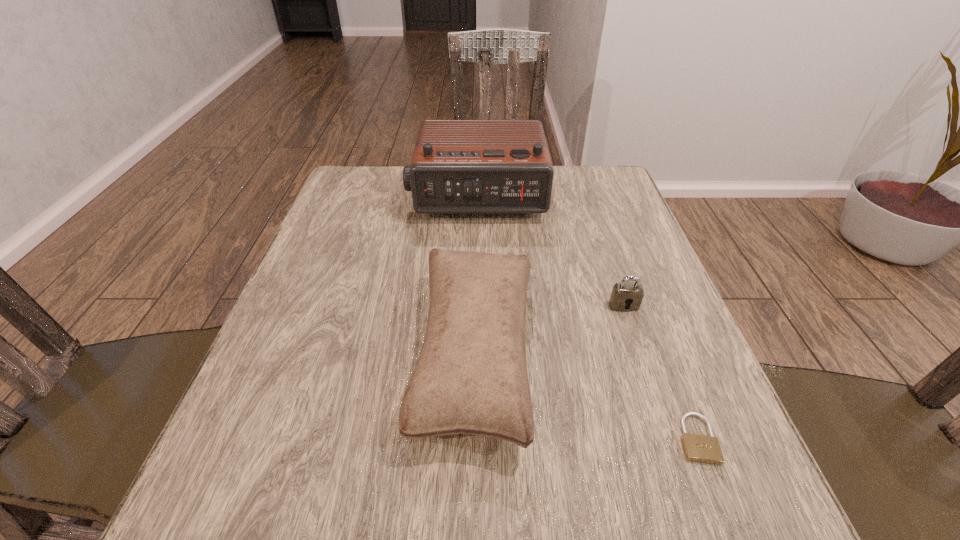
Image resolution: width=960 pixels, height=540 pixels. In order to click on free spot between the taller padlock and the nearer padlock in this screenshot , I will do `click(660, 372)`.

Where is `unoccupied position between the farther padlock and the nearer padlock`? unoccupied position between the farther padlock and the nearer padlock is located at coordinates (660, 372).

At what (x,y) coordinates should I click in order to perform the action: click on empty location between the second tallest object and the shorter padlock. Please return your answer as a coordinate pair (x, y). The height and width of the screenshot is (540, 960). Looking at the image, I should click on (586, 396).

Find the location of a particular element. This screenshot has width=960, height=540. blank region between the second tallest object and the shortest object is located at coordinates (586, 396).

This screenshot has height=540, width=960. I want to click on vacant space that's between the tallest object and the shorter padlock, so click(587, 317).

Identify which object is the second closest to the taller padlock. Please provide its 2D coordinates. Your answer should be formatted as a tuple, i.e. [(x, y)], where the tuple contains the x and y coordinates of a point satisfying the conditions above.

[(698, 448)]

Identify the location of object that is the closest to the radio receiver. (471, 377).

Where is `blank space that satisfies the following two spatial constraints: 1. on the front side of the cushion; 2. on the right side of the shortest object`? This screenshot has width=960, height=540. blank space that satisfies the following two spatial constraints: 1. on the front side of the cushion; 2. on the right side of the shortest object is located at coordinates (475, 438).

Find the location of a particular element. free space that satisfies the following two spatial constraints: 1. on the front panel of the cushion; 2. on the right side of the radio receiver is located at coordinates (475, 354).

This screenshot has width=960, height=540. I want to click on free space that satisfies the following two spatial constraints: 1. on the front panel of the cushion; 2. on the left side of the tallest object, so click(x=475, y=354).